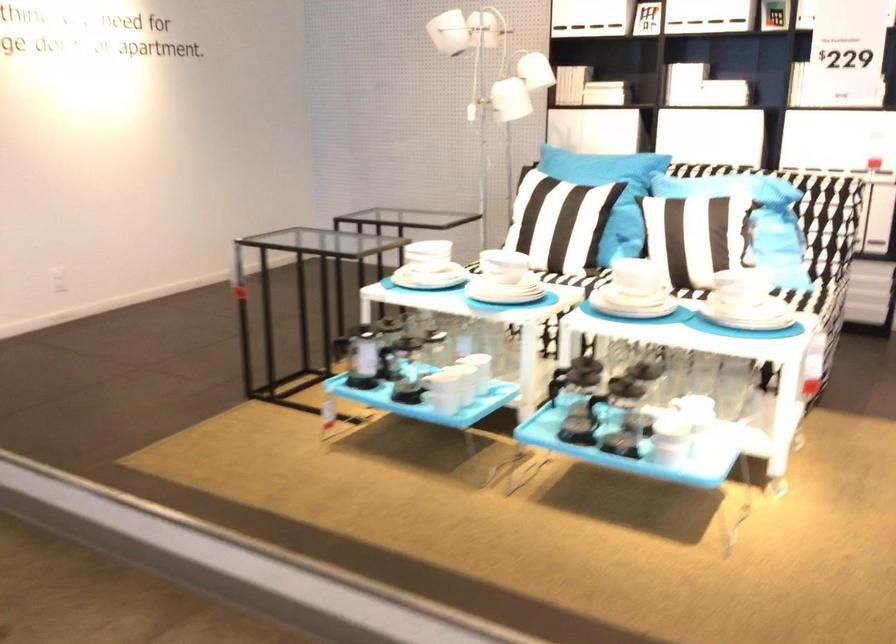
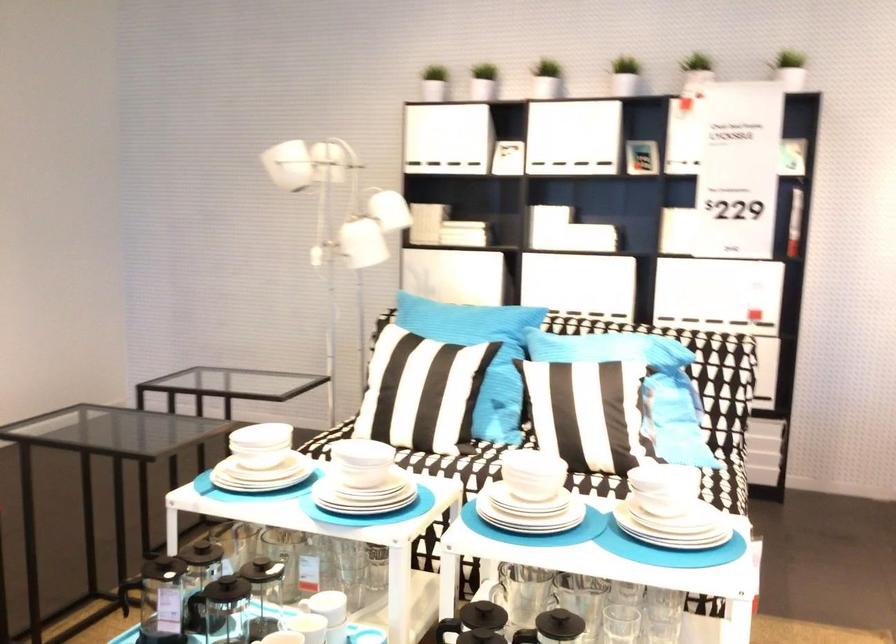
The point at (730,172) is marked in the first image. Where is the corresponding point in the second image?

(615, 345)